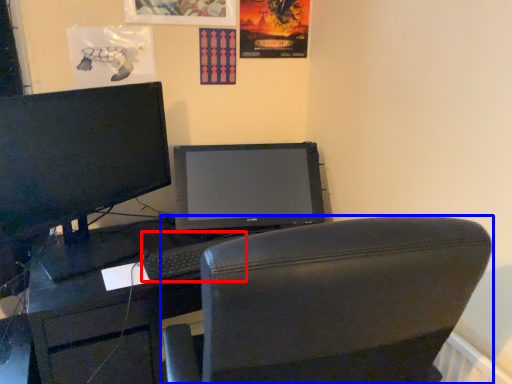
Question: Which point is closer to the camera, keyboard (highlighted by a red box) or chair (highlighted by a blue box)?

Choices:
 (A) keyboard
 (B) chair

Answer: (B)